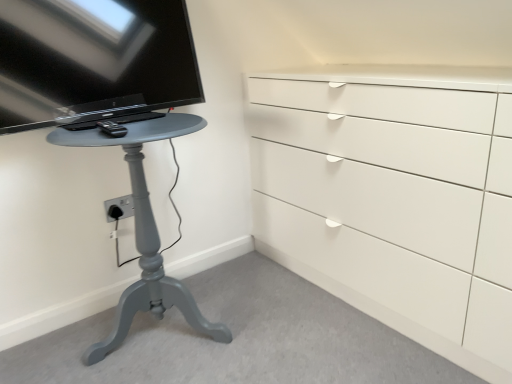
Question: Is black glossy tv at upper left in front of or behind black plastic remote control at left in the image?

Choices:
 (A) front
 (B) behind

Answer: (A)

Question: In terms of size, does black glossy tv at upper left appear bigger or smaller than black plastic remote control at left?

Choices:
 (A) small
 (B) big

Answer: (B)

Question: Based on their relative distances, which object is farther from the matte gray table at left?

Choices:
 (A) black glossy tv at upper left
 (B) black plastic remote control at left

Answer: (B)

Question: Considering the real-world distances, which object is closest to the matte gray table at left?

Choices:
 (A) black glossy tv at upper left
 (B) black plastic remote control at left

Answer: (A)